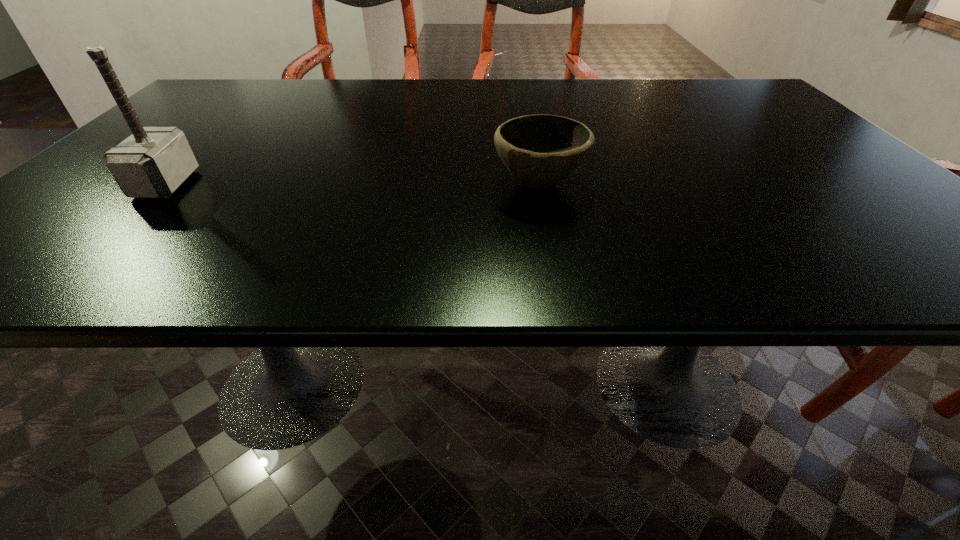
At what (x,y) coordinates should I click in order to perform the action: click on the taller object. Please return your answer as a coordinate pair (x, y). Image resolution: width=960 pixels, height=540 pixels. Looking at the image, I should click on (153, 162).

At what (x,y) coordinates should I click in order to perform the action: click on hammer. Please return your answer as a coordinate pair (x, y). Looking at the image, I should click on (153, 162).

This screenshot has height=540, width=960. In order to click on bowl in this screenshot , I will do `click(541, 151)`.

Image resolution: width=960 pixels, height=540 pixels. Find the location of `the right object`. the right object is located at coordinates (541, 151).

This screenshot has height=540, width=960. I want to click on free space located for striking with the head of the taller object, so click(x=259, y=184).

This screenshot has width=960, height=540. Identify the location of vacant region located on the back of the shorter object. (525, 110).

I want to click on object that is positioned at the left edge, so click(153, 162).

The height and width of the screenshot is (540, 960). In the image, there is a desktop. Identify the location of free space at the far edge. (335, 91).

Locate an element on the screen. free region at the near edge of the desktop is located at coordinates (461, 261).

Image resolution: width=960 pixels, height=540 pixels. Identify the location of vacant point at the left edge. (199, 133).